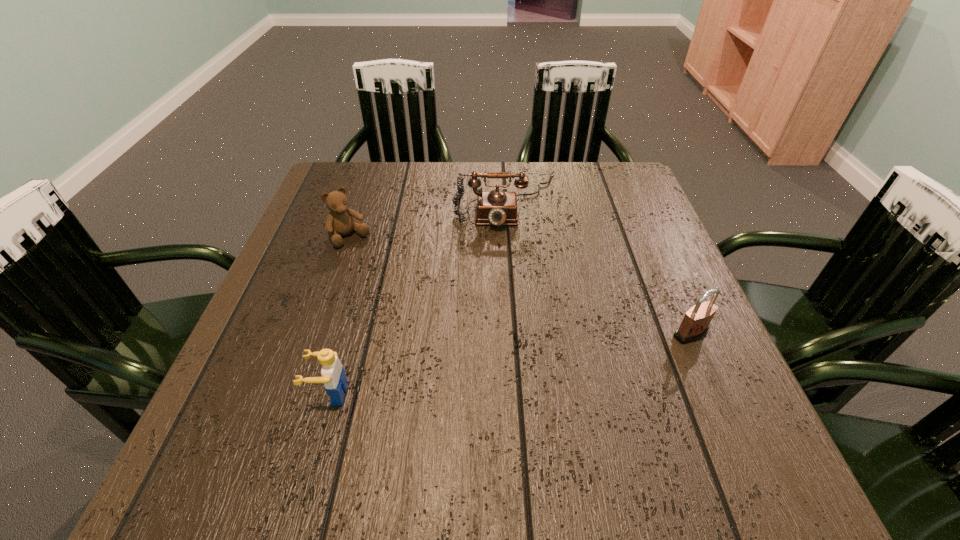
Identify the location of free spot on the desktop that is between the Lego and the rightmost object and is positioned on the dial of the third object from left to right. (516, 363).

Locate an element on the screen. free spot on the desktop that is between the Lego and the rightmost object and is positioned on the front-facing side of the teddy bear is located at coordinates (467, 371).